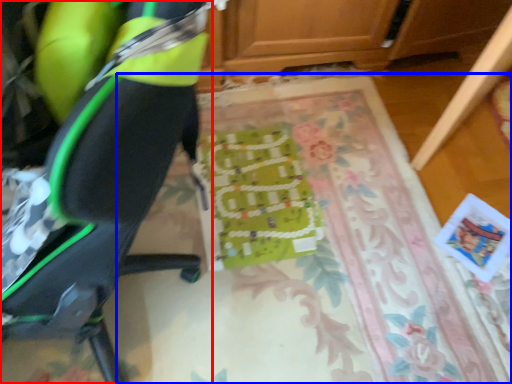
Question: Which object appears farthest to the camera in this image, chair (highlighted by a red box) or mat (highlighted by a blue box)?

Choices:
 (A) chair
 (B) mat

Answer: (B)